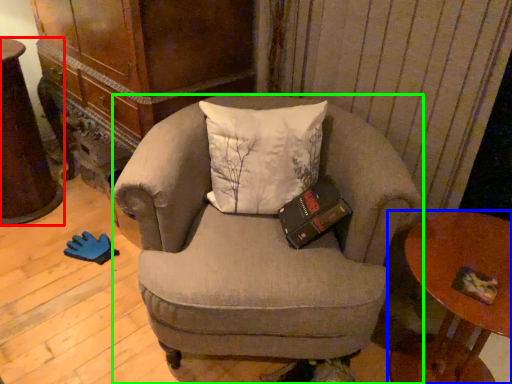
Question: Estimate the real-world distances between objects in this image. Which object is farther from desk (highlighted by a red box), table (highlighted by a blue box) or chair (highlighted by a green box)?

Choices:
 (A) table
 (B) chair

Answer: (A)